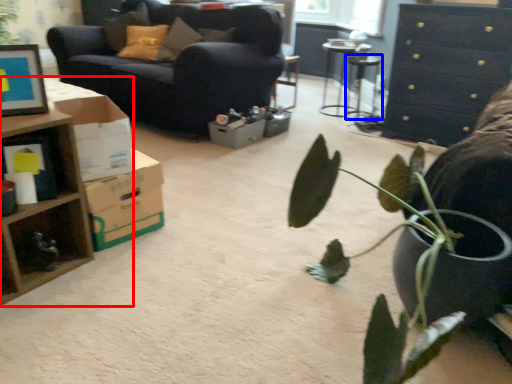
Question: Which object is closer to the camera taking this photo, desk (highlighted by a red box) or table (highlighted by a blue box)?

Choices:
 (A) desk
 (B) table

Answer: (A)